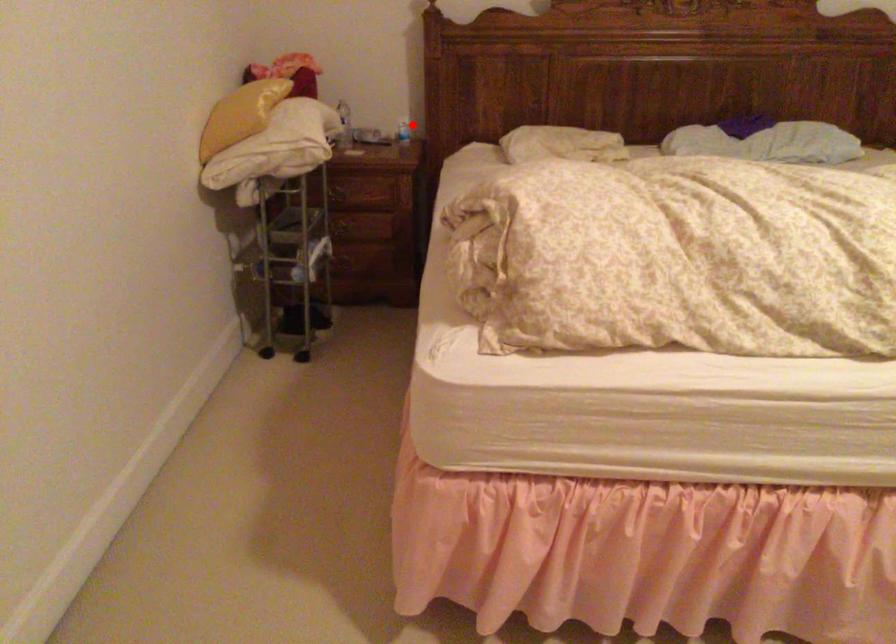
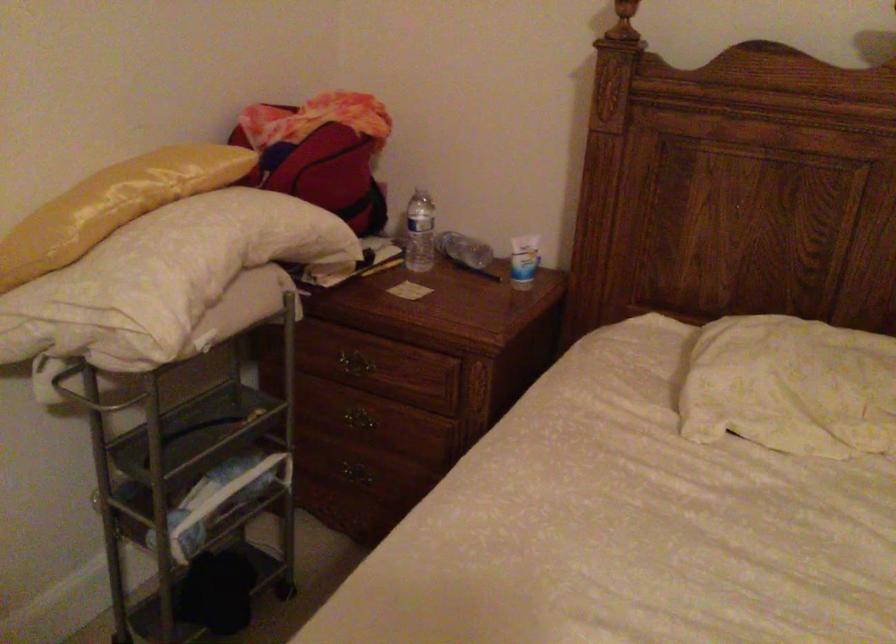
In the second image, find the point that corresponds to the highlighted location in the first image.

(523, 261)